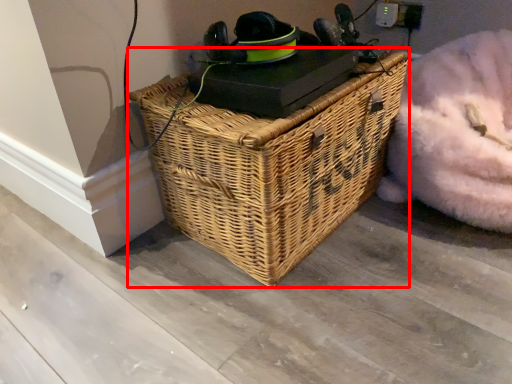
Question: Considering the relative positions of picnic basket (annotated by the red box) and bean bag chair in the image provided, where is picnic basket (annotated by the red box) located with respect to the staircase?

Choices:
 (A) left
 (B) right

Answer: (A)